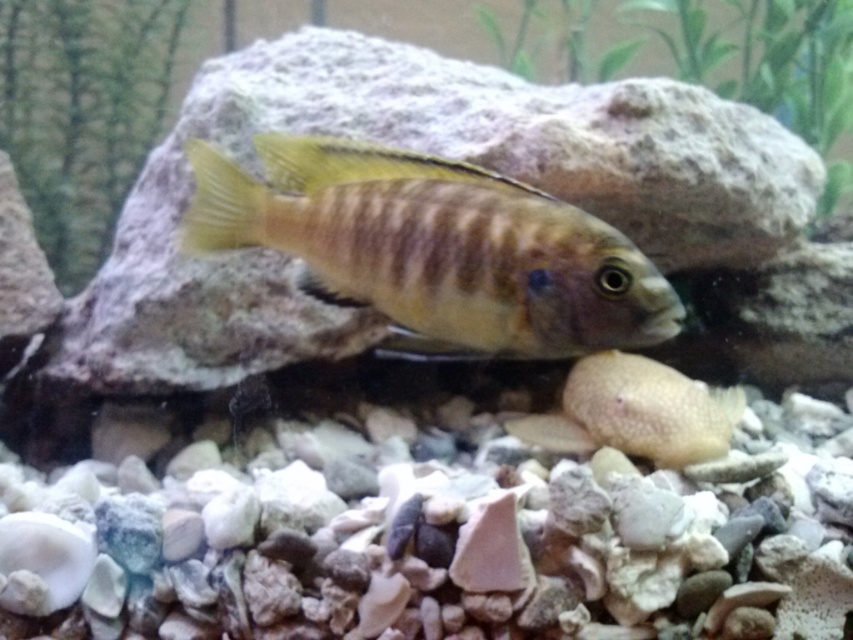
Does point (590, 216) come farther from viewer compared to point (627, 397)?

No, it is not.

Who is positioned more to the right, shiny brown fish at center or smooth beige rock at center?

From the viewer's perspective, smooth beige rock at center appears more on the right side.

Is point (647, 326) positioned before point (735, 412)?

Yes, it is.

Where is `shiny brown fish at center`? shiny brown fish at center is located at coordinates (434, 248).